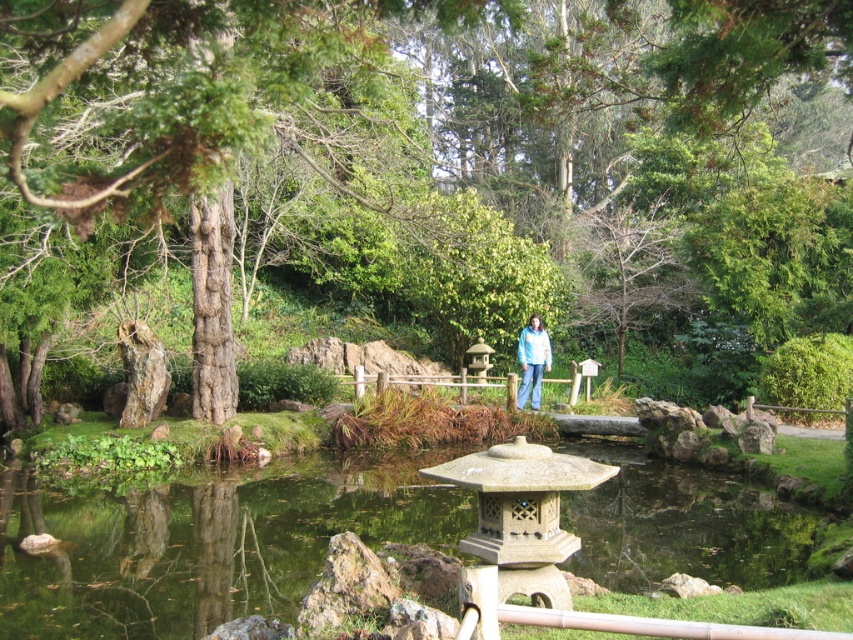
Question: Is clear water at pond center above blue fabric jacket at center?

Choices:
 (A) no
 (B) yes

Answer: (A)

Question: Can you confirm if green textured tree at center is smaller than blue fabric jacket at center?

Choices:
 (A) no
 (B) yes

Answer: (A)

Question: Among these points, which one is nearest to the camera?

Choices:
 (A) (80, 576)
 (B) (820, 58)
 (C) (546, 356)

Answer: (A)

Question: Among these objects, which one is nearest to the camera?

Choices:
 (A) green textured tree at center
 (B) blue fabric jacket at center
 (C) clear water at pond center

Answer: (A)

Question: Which of the following is the closest to the observer?

Choices:
 (A) blue fabric jacket at center
 (B) green textured tree at center

Answer: (B)

Question: Where is green textured tree at center located in relation to clear water at pond center in the image?

Choices:
 (A) above
 (B) below

Answer: (A)